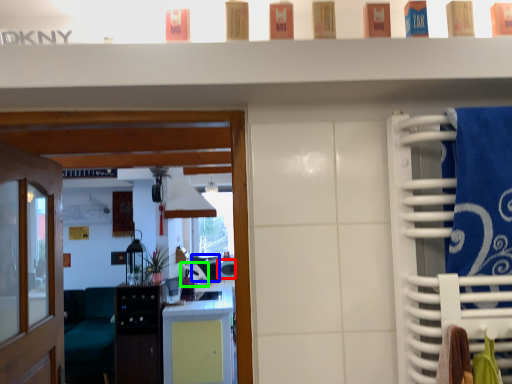
Question: Which object is the farthest from appliance (highlighted by a red box)? Choose among these: appliance (highlighted by a blue box) or appliance (highlighted by a green box).

Choices:
 (A) appliance
 (B) appliance

Answer: (B)